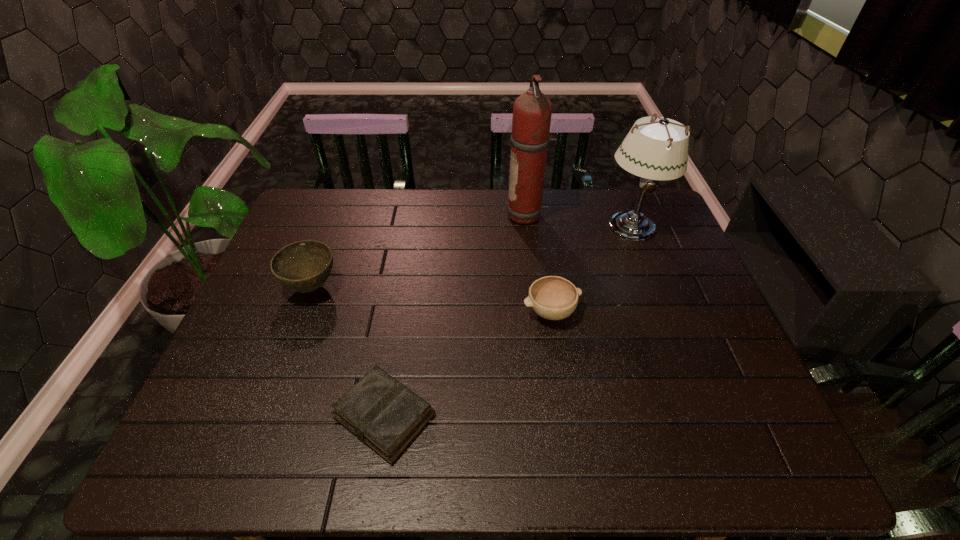
Locate an element on the screen. The image size is (960, 540). object located at the right edge is located at coordinates (658, 150).

The image size is (960, 540). I want to click on object that is positioned at the far right corner, so click(658, 150).

Identify the location of free region at the far edge. (401, 224).

The height and width of the screenshot is (540, 960). In order to click on vacant space at the near edge in this screenshot , I will do `click(572, 435)`.

Image resolution: width=960 pixels, height=540 pixels. In order to click on vacant space at the left edge of the desktop in this screenshot , I will do `click(261, 343)`.

Locate an element on the screen. vacant space at the right edge of the desktop is located at coordinates (727, 403).

In order to click on vacant space at the far left corner of the desktop in this screenshot , I will do `click(348, 191)`.

You are a GUI agent. You are given a task and a screenshot of the screen. Output one action in this format:
    pyautogui.click(x=<x>, y=<y>)
    Task: Click on the unoccupied area between the nearest object and the lampshade
    Image resolution: width=960 pixels, height=540 pixels.
    Given the screenshot: What is the action you would take?
    pyautogui.click(x=508, y=321)

Find the location of `free spot between the shorter bowl and the tallest object`. free spot between the shorter bowl and the tallest object is located at coordinates (539, 264).

The width and height of the screenshot is (960, 540). I want to click on free area in between the shortest object and the lampshade, so point(508,321).